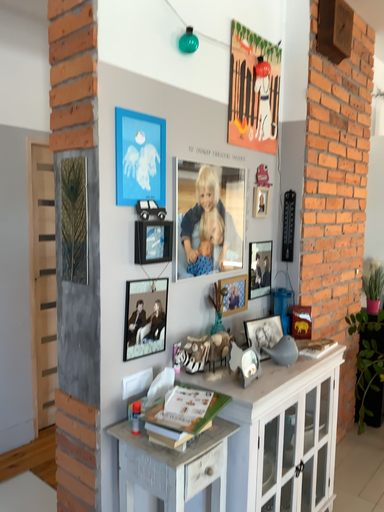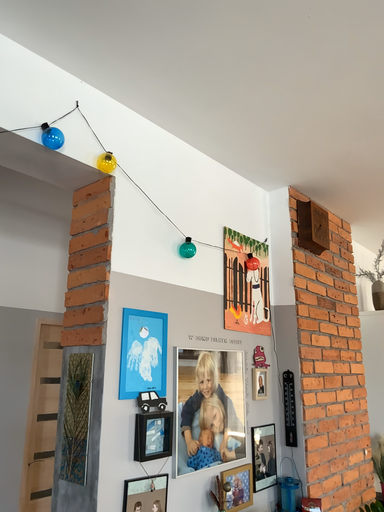
Question: How did the camera likely rotate when shooting the video?

Choices:
 (A) rotated downward
 (B) rotated upward

Answer: (B)